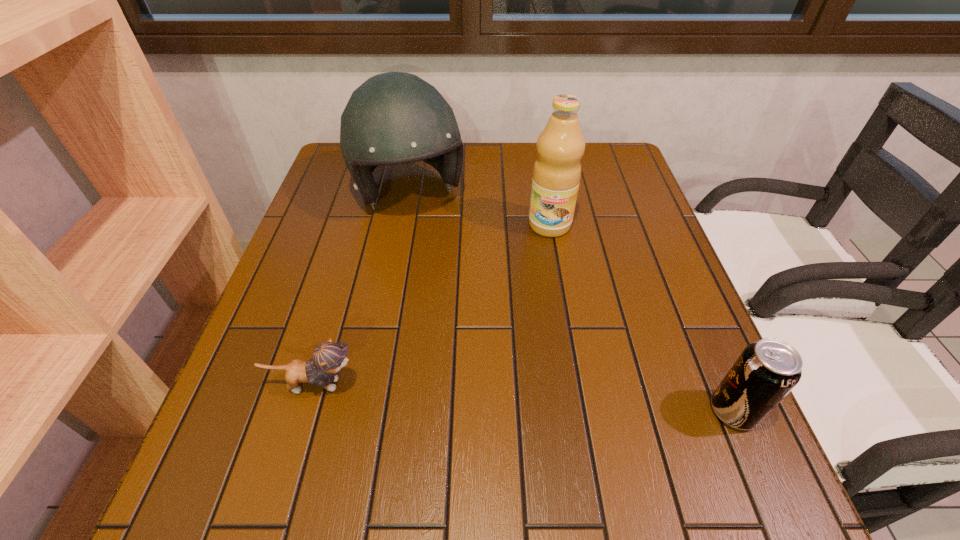
Find the location of `empty location between the football helmet and the olive oil`. empty location between the football helmet and the olive oil is located at coordinates (480, 210).

You are a GUI agent. You are given a task and a screenshot of the screen. Output one action in this format:
    pyautogui.click(x=<x>, y=<y>)
    Task: Click on the vacant area that lies between the soda can and the football helmet
    The height and width of the screenshot is (540, 960).
    Given the screenshot: What is the action you would take?
    pyautogui.click(x=571, y=302)

Where is `unoccupied area between the olive oil and the third tallest object`? This screenshot has height=540, width=960. unoccupied area between the olive oil and the third tallest object is located at coordinates (641, 318).

You are a GUI agent. You are given a task and a screenshot of the screen. Output one action in this format:
    pyautogui.click(x=<x>, y=<y>)
    Task: Click on the free spot between the football helmet and the shortest object
    The width and height of the screenshot is (960, 540).
    Given the screenshot: What is the action you would take?
    pyautogui.click(x=362, y=289)

What are the coordinates of `free space between the olive oil and the rightmost object` in the screenshot? It's located at (641, 318).

Identify the location of free area in between the rightmost object and the kitten. (523, 397).

Select which object appears as the closest to the shortest object. Please provide its 2D coordinates. Your answer should be formatted as a tuple, i.e. [(x, y)], where the tuple contains the x and y coordinates of a point satisfying the conditions above.

[(393, 118)]

The image size is (960, 540). Find the location of `the third closest object to the olive oil`. the third closest object to the olive oil is located at coordinates (328, 358).

Locate an element on the screen. Image resolution: width=960 pixels, height=540 pixels. blank space that satisfies the following two spatial constraints: 1. on the front side of the second object from right to left; 2. on the left side of the football helmet is located at coordinates (404, 225).

At what (x,y) coordinates should I click in order to perform the action: click on blank space that satisfies the following two spatial constraints: 1. on the front side of the rightmost object; 2. on the left side of the football helmet. Please return your answer as a coordinate pair (x, y). The image size is (960, 540). Looking at the image, I should click on (369, 411).